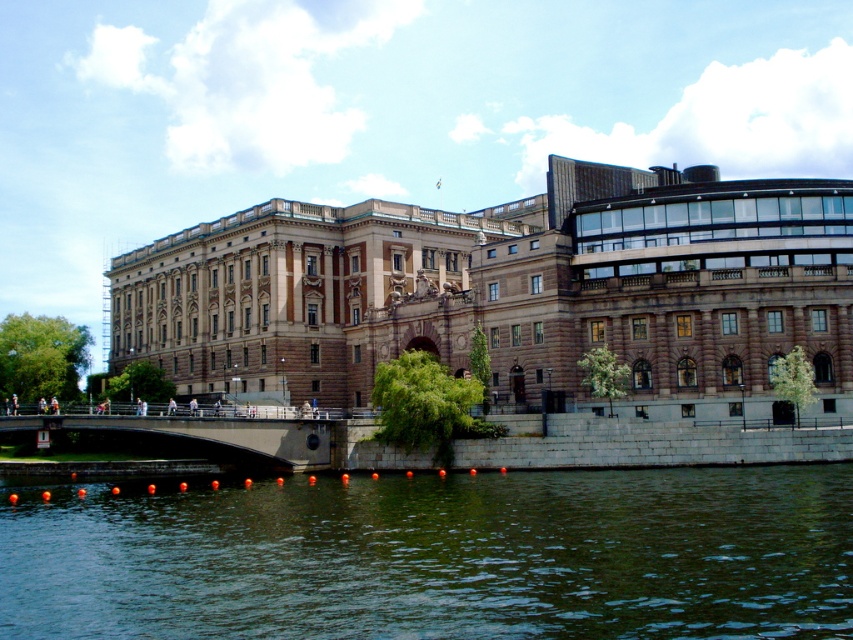
Question: Does greenish water at lower center have a greater width compared to concrete bridge at center?

Choices:
 (A) yes
 (B) no

Answer: (A)

Question: Does greenish water at lower center appear under concrete bridge at center?

Choices:
 (A) yes
 (B) no

Answer: (A)

Question: Is greenish water at lower center bigger than concrete bridge at center?

Choices:
 (A) no
 (B) yes

Answer: (B)

Question: Which of the following is the farthest from the observer?

Choices:
 (A) greenish water at lower center
 (B) concrete bridge at center

Answer: (B)

Question: Which of the following is the farthest from the observer?

Choices:
 (A) greenish water at lower center
 (B) concrete bridge at center

Answer: (B)